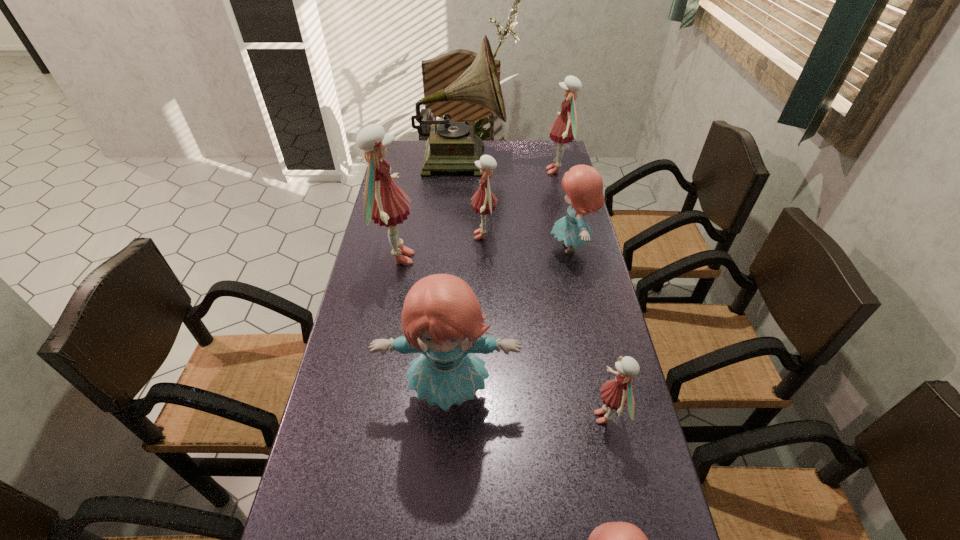
The image size is (960, 540). I want to click on free location located on the front-facing side of the farthest blue doll, so click(x=484, y=248).

Identify the location of vacant point located on the front-facing side of the farthest blue doll. pos(460,248).

Where is `blank area located on the front-facing side of the nearest pink doll`? This screenshot has width=960, height=540. blank area located on the front-facing side of the nearest pink doll is located at coordinates (566, 417).

This screenshot has height=540, width=960. What are the coordinates of `blank space located 0.150m on the front-facing side of the nearest pink doll` in the screenshot? It's located at (527, 417).

Find the location of a particular element. The height and width of the screenshot is (540, 960). free space located on the front-facing side of the nearest pink doll is located at coordinates (428, 417).

Locate an element on the screen. This screenshot has height=540, width=960. record player positioned at the far edge is located at coordinates (453, 146).

Where is `doll situated at the far edge`? The image size is (960, 540). doll situated at the far edge is located at coordinates (564, 130).

I want to click on record player situated at the left edge, so click(453, 146).

Identify the location of object present at the far left corner. Image resolution: width=960 pixels, height=540 pixels. (453, 146).

Locate an element on the screen. object that is at the far right corner is located at coordinates (564, 130).